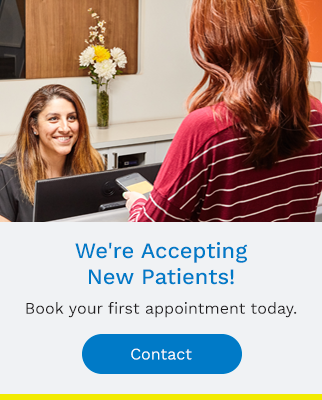
This screenshot has width=322, height=400. Find the location of `window`. window is located at coordinates (34, 50).